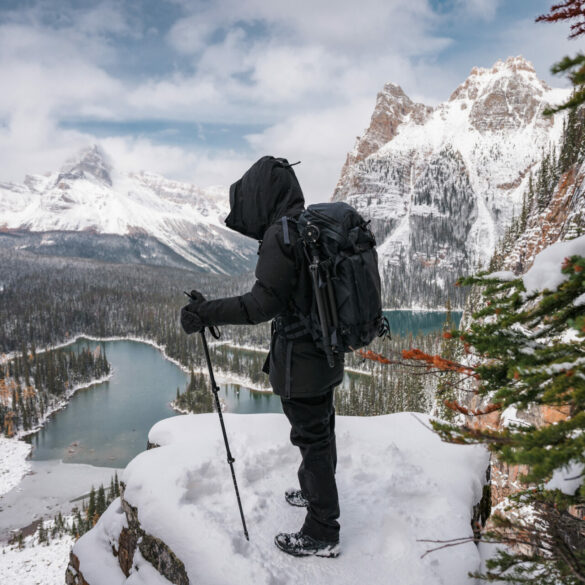
At what (x,y) coordinates should I click in order to perform the action: click on hood. Please return your answer as a coordinate pair (x, y). Looking at the image, I should click on (270, 185).